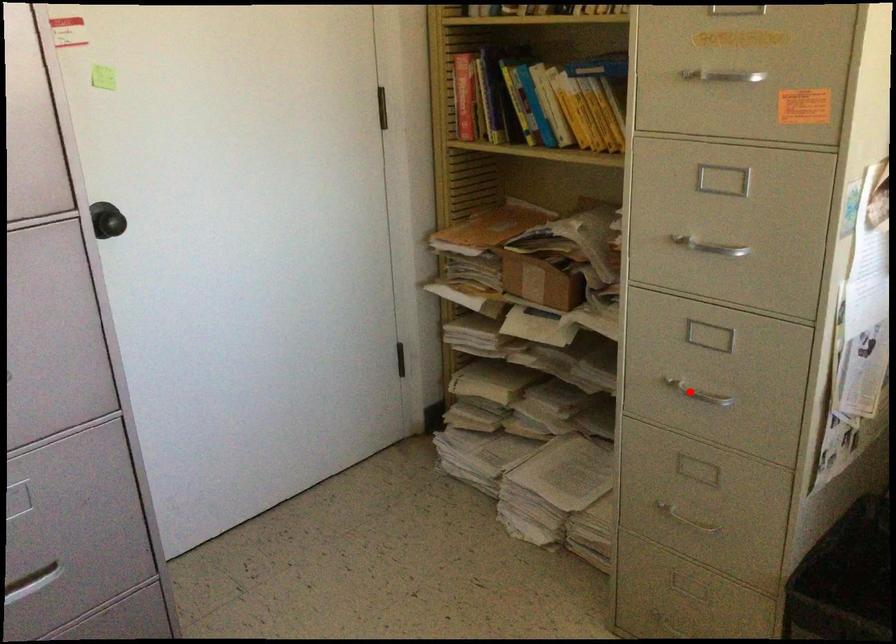
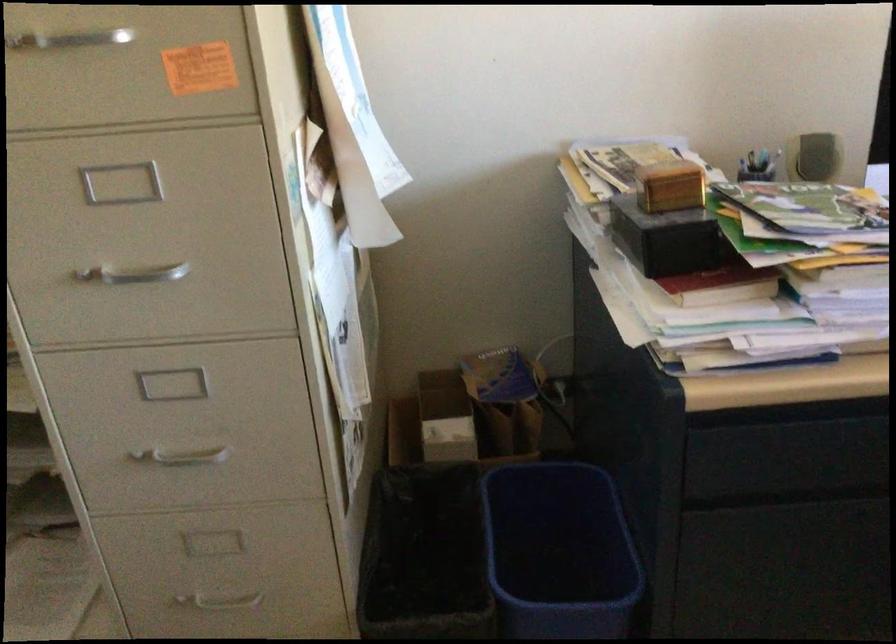
Find the pixel in the second image that matches the highlighted location in the first image.

(181, 456)